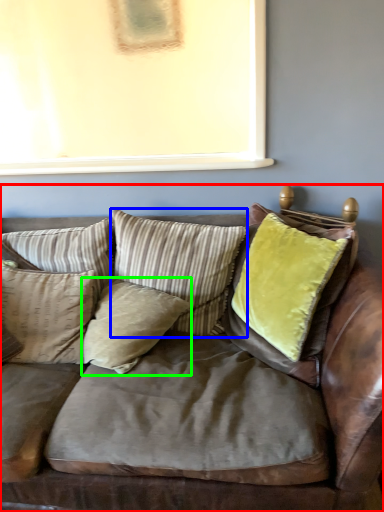
Question: Which object is positioned farthest from studio couch (highlighted by a red box)? Select from pillow (highlighted by a blue box) and pillow (highlighted by a green box).

Choices:
 (A) pillow
 (B) pillow

Answer: (A)